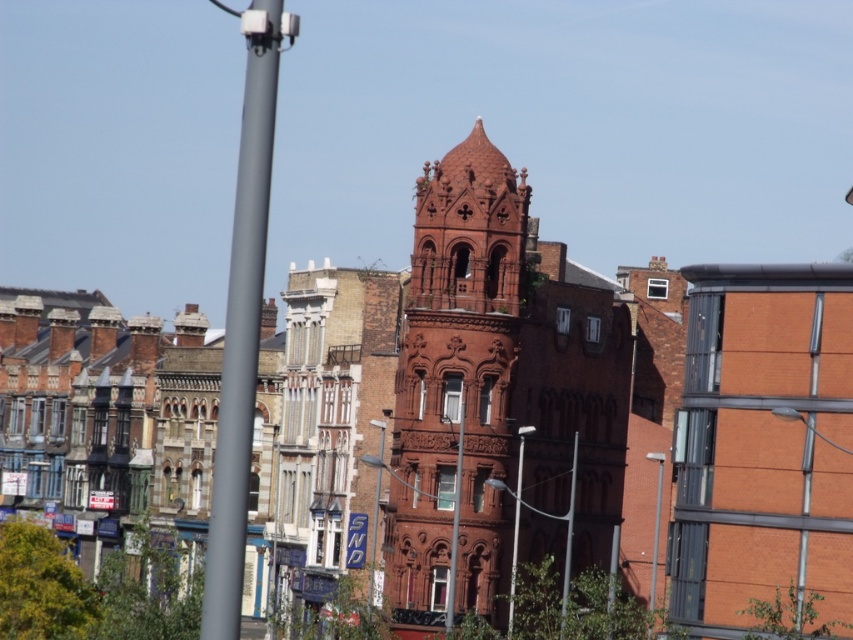
You are a city planner evaluating the urban space in front of the red brick building. You notice the metallic silver streetlight at center and the metallic pole at center. Which object would cast a longer shadow during midday when the sun is directly overhead?

The metallic silver streetlight at center is taller than the metallic pole at center, so it would cast a longer shadow during midday when the sun is directly overhead.

You are a city planner analyzing the urban layout. You need to install a new sensor on the closest pole to the central building. Which pole should you choose between the smooth gray pole at left and the matte metal pole at center?

The smooth gray pole at left is closer to the viewer than the matte metal pole at center, so the smooth gray pole at left is the closest to the central building and should be chosen for installing the sensor.

You are a city planner reviewing the urban layout. You need to determine the spatial relationship between the metallic silver streetlight at center and the metallic pole at center. Which object is positioned to the left?

The metallic silver streetlight at center is positioned to the left of the metallic pole at center.